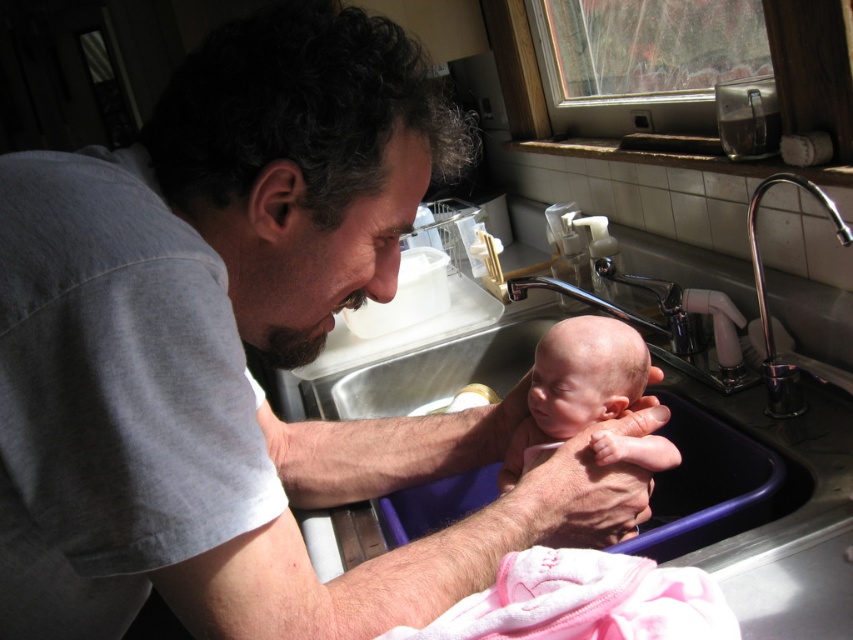
You are a parent trying to decide whether to place a small toy next to the smooth skin newborn at center. The toy is the same height as the chrome metallic faucet at sink right. Will the newborn at center be shorter than the toy?

The smooth skin newborn at center is not as tall as the chrome metallic faucet at sink right, so yes, the newborn at center will be shorter than the toy since the toy is the same height as the faucet.

Based on the scene description, where is the smooth skin newborn at center located in terms of coordinates?

The smooth skin newborn at center is located at coordinates point [578,384].